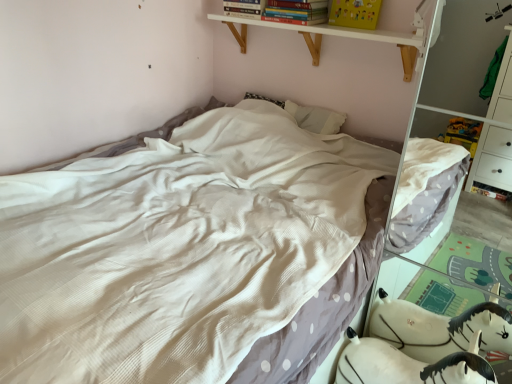
What are the coordinates of `hardcover book at upper center, placed as the 2th book when sorted from left to right` in the screenshot? It's located at (285, 12).

At what (x,y) coordinates should I click in order to perform the action: click on hardcover book at upper center, which appears as the first book when viewed from the left. Please return your answer as a coordinate pair (x, y). This screenshot has height=384, width=512. Looking at the image, I should click on (244, 8).

The height and width of the screenshot is (384, 512). I want to click on white textured bed at center, so click(x=175, y=251).

Does hardcover book at upper center, the second book viewed from the right, have a lesser width compared to white plush toy at lower right?

Correct, the width of hardcover book at upper center, the second book viewed from the right, is less than that of white plush toy at lower right.

Does hardcover book at upper center, the second book viewed from the right, have a lesser height compared to white plush toy at lower right?

Correct, hardcover book at upper center, the second book viewed from the right, is not as tall as white plush toy at lower right.

Is hardcover book at upper center, the second book viewed from the right, surrounding white plush toy at lower right?

No, white plush toy at lower right is not a part of hardcover book at upper center, the second book viewed from the right.

The width and height of the screenshot is (512, 384). Find the location of `book below the hardcover book at upper center, the second book viewed from the right (from a real-world perspective)`. book below the hardcover book at upper center, the second book viewed from the right (from a real-world perspective) is located at coordinates (285, 12).

Is hardcover book at upper center, placed as the 2th book when sorted from left to right, positioned with its back to hardcover book at upper center, which appears as the first book when viewed from the left?

No, hardcover book at upper center, placed as the 2th book when sorted from left to right, is not facing away from hardcover book at upper center, which appears as the first book when viewed from the left.

Considering the positions of objects hardcover book at upper center, placed as the 2th book when sorted from left to right, and hardcover book at upper center, which appears as the first book when viewed from the left, in the image provided, who is in front, hardcover book at upper center, placed as the 2th book when sorted from left to right, or hardcover book at upper center, which appears as the first book when viewed from the left,?

hardcover book at upper center, placed as the 2th book when sorted from left to right, is more forward.

Between point (264, 8) and point (426, 310), which one is positioned behind?

The point (264, 8) is behind.

Is hardcover book at upper center, the 1th book viewed from the right, at the right side of white plush toy at lower right?

In fact, hardcover book at upper center, the 1th book viewed from the right, is to the left of white plush toy at lower right.

From a real-world perspective, which object rests below the other?

In real-world perspective, white plush toy at lower right is lower.

Considering the sizes of objects hardcover book at upper center, placed as the 2th book when sorted from left to right, and white plush toy at lower right in the image provided, who is taller, hardcover book at upper center, placed as the 2th book when sorted from left to right, or white plush toy at lower right?

Standing taller between the two is white plush toy at lower right.

Can you confirm if white plush toy at lower right is shorter than hardcover book at upper center, which appears as the first book when viewed from the left?

No, white plush toy at lower right is not shorter than hardcover book at upper center, which appears as the first book when viewed from the left.

Could you tell me if white plush toy at lower right is facing hardcover book at upper center, the second book viewed from the right?

No.

Considering the sizes of white plush toy at lower right and hardcover book at upper center, which appears as the first book when viewed from the left, in the image, is white plush toy at lower right bigger or smaller than hardcover book at upper center, which appears as the first book when viewed from the left,?

Clearly, white plush toy at lower right is larger in size than hardcover book at upper center, which appears as the first book when viewed from the left.

From a real-world perspective, is white plush toy at lower right beneath hardcover book at upper center, which appears as the first book when viewed from the left?

Yes, from a real-world perspective, white plush toy at lower right is below hardcover book at upper center, which appears as the first book when viewed from the left.

Looking at this image, does white textured bed at center turn towards hardcover book at upper center, the 1th book viewed from the right?

No.

Based on their sizes in the image, would you say white textured bed at center is bigger or smaller than hardcover book at upper center, placed as the 2th book when sorted from left to right?

white textured bed at center is bigger than hardcover book at upper center, placed as the 2th book when sorted from left to right.

Is hardcover book at upper center, placed as the 2th book when sorted from left to right, surrounded by white textured bed at center?

That's incorrect, hardcover book at upper center, placed as the 2th book when sorted from left to right, is not inside white textured bed at center.

Considering the positions of points (406, 40) and (128, 330), is point (406, 40) closer to camera compared to point (128, 330)?

That is False.

Based on the photo, how different are the orientations of white wood shelf at upper center and white textured bed at center in degrees?

0.575 degrees separate the facing orientations of white wood shelf at upper center and white textured bed at center.

Is white textured bed at center at the back of white wood shelf at upper center?

No, white textured bed at center is not at the back of white wood shelf at upper center.

Which object is wider, white textured bed at center or white plush toy at lower right?

Wider between the two is white textured bed at center.

From a real-world perspective, is white textured bed at center physically above white plush toy at lower right?

Indeed, from a real-world perspective, white textured bed at center stands above white plush toy at lower right.

Is white textured bed at center bigger than white plush toy at lower right?

Yes.

Which point is more forward, (275, 231) or (490, 326)?

Positioned in front is point (490, 326).

Find the location of a particular element. animal beneath the hardcover book at upper center, the second book viewed from the right (from a real-world perspective) is located at coordinates (439, 328).

Locate an element on the screen. Image resolution: width=512 pixels, height=384 pixels. book in front of the hardcover book at upper center, which appears as the first book when viewed from the left is located at coordinates (285, 12).

When comparing their distances from white textured bed at center, does white wood shelf at upper center or hardcover book at upper center, which appears as the first book when viewed from the left, seem further?

The object further to white textured bed at center is hardcover book at upper center, which appears as the first book when viewed from the left.

From the image, which object appears to be nearer to hardcover book at upper center, which appears as the first book when viewed from the left, white wood shelf at upper center or white plush toy at lower right?

white wood shelf at upper center lies closer to hardcover book at upper center, which appears as the first book when viewed from the left, than the other object.

When comparing their distances from hardcover book at upper center, which appears as the first book when viewed from the left, does white plush toy at lower right or white textured bed at center seem closer?

The object closer to hardcover book at upper center, which appears as the first book when viewed from the left, is white textured bed at center.

From the image, which object appears to be farther from hardcover book at upper center, the 1th book viewed from the right, white plush toy at lower right or hardcover book at upper center, which appears as the first book when viewed from the left?

Based on the image, white plush toy at lower right appears to be further to hardcover book at upper center, the 1th book viewed from the right.

Based on their spatial positions, is white wood shelf at upper center or hardcover book at upper center, placed as the 2th book when sorted from left to right, further from hardcover book at upper center, the second book viewed from the right?

Based on the image, white wood shelf at upper center appears to be further to hardcover book at upper center, the second book viewed from the right.

When comparing their distances from white wood shelf at upper center, does white plush toy at lower right or hardcover book at upper center, which appears as the first book when viewed from the left, seem closer?

hardcover book at upper center, which appears as the first book when viewed from the left.

In the scene shown: Looking at the image, which one is located further to hardcover book at upper center, the 1th book viewed from the right, white textured bed at center or hardcover book at upper center, the second book viewed from the right?

Among the two, white textured bed at center is located further to hardcover book at upper center, the 1th book viewed from the right.

When comparing their distances from white wood shelf at upper center, does white plush toy at lower right or hardcover book at upper center, the 1th book viewed from the right, seem further?

The object further to white wood shelf at upper center is white plush toy at lower right.

Locate an element on the screen. This screenshot has width=512, height=384. book between hardcover book at upper center, which appears as the first book when viewed from the left, and white plush toy at lower right, in the vertical direction is located at coordinates (285, 12).

Where is `bed that lies between white wood shelf at upper center and white plush toy at lower right from top to bottom`? This screenshot has height=384, width=512. bed that lies between white wood shelf at upper center and white plush toy at lower right from top to bottom is located at coordinates (175, 251).

This screenshot has height=384, width=512. In order to click on shelf between white textured bed at center and hardcover book at upper center, which appears as the first book when viewed from the left, from front to back in this screenshot , I will do `click(351, 35)`.

You are a GUI agent. You are given a task and a screenshot of the screen. Output one action in this format:
    pyautogui.click(x=<x>, y=<y>)
    Task: Click on the bed between hardcover book at upper center, the 1th book viewed from the right, and white plush toy at lower right vertically
    This screenshot has height=384, width=512.
    Given the screenshot: What is the action you would take?
    coord(175,251)